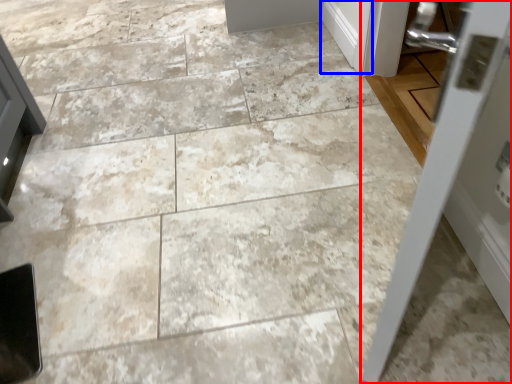
Question: Among these objects, which one is farthest to the camera, door (highlighted by a red box) or door (highlighted by a blue box)?

Choices:
 (A) door
 (B) door

Answer: (B)